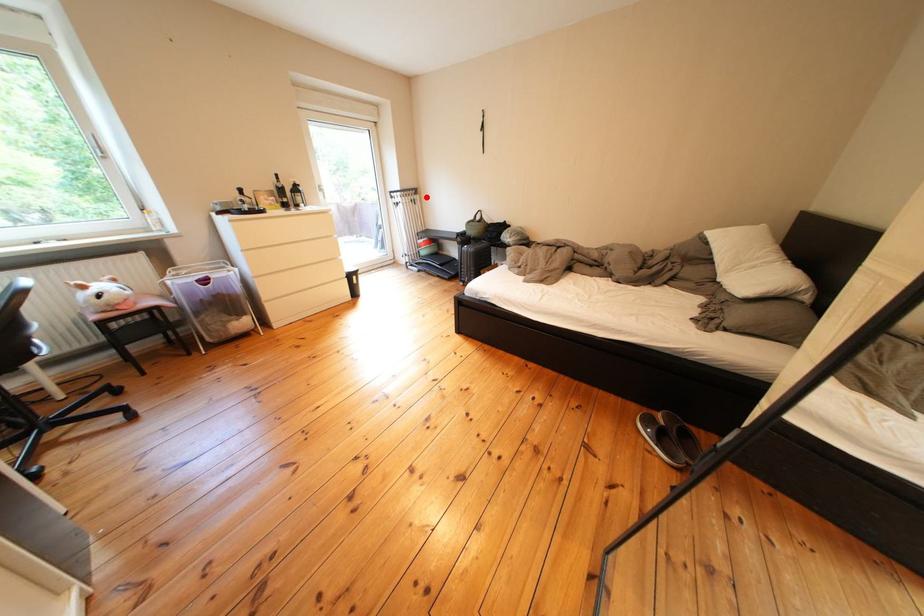
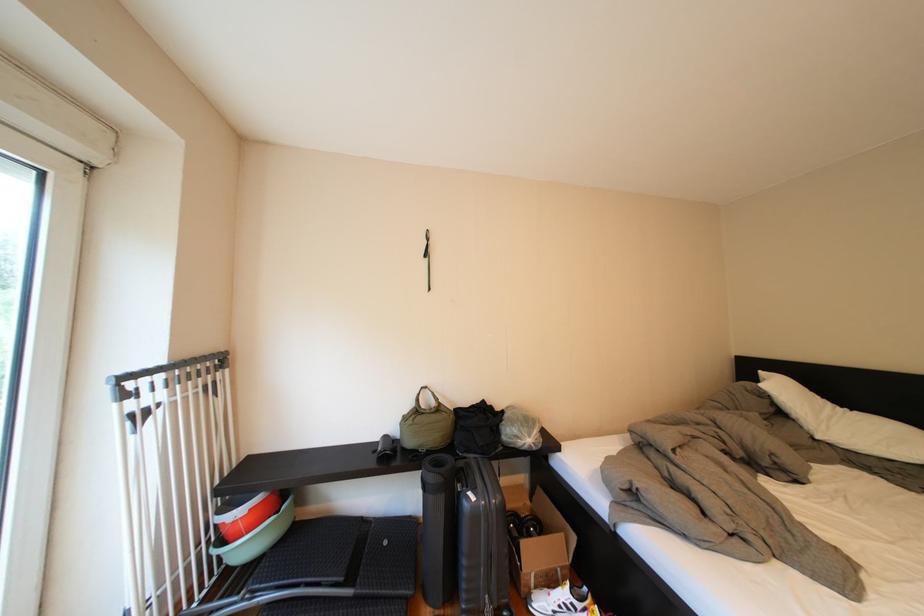
Question: I am providing you with two images of the same scene from different viewpoints. In image1, a red point is highlighted. Considering the same 3D point in image2, which of the following is correct?

Choices:
 (A) It is closer
 (B) It is farther

Answer: (B)